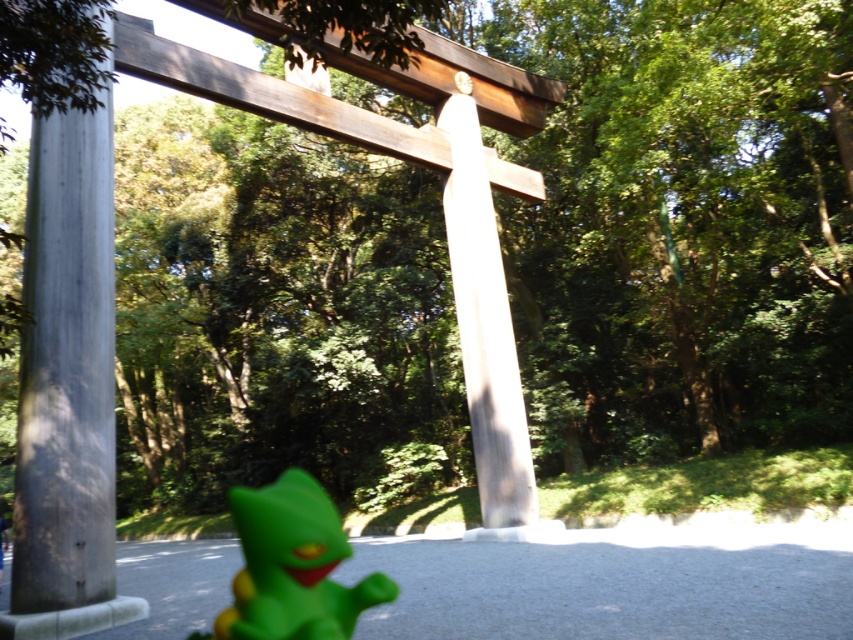
Based on the photo, you are standing in front of the traditional Japanese torii gate and see the smooth gray pole at left and the smooth white pillar at center. Which object is located to the left of the other?

The smooth gray pole at left is positioned on the left side of the smooth white pillar at center.

You are a visitor at a Shinto shrine and want to take a photo of the smooth gray pole at left and the smooth white pillar at center. Which object should you focus on first if you want to capture both in the frame without moving the camera?

You should focus on the smooth white pillar at center first because it is closer to you than the smooth gray pole at left, allowing both to be in the frame without moving the camera.